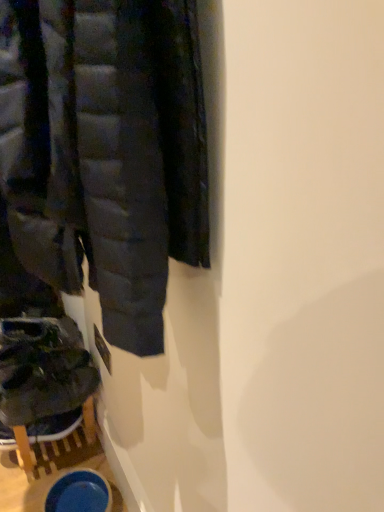
Question: Considering the relative positions of dark gray suede shoes at lower left and matte black jacket at left in the image provided, is dark gray suede shoes at lower left in front of matte black jacket at left?

Choices:
 (A) no
 (B) yes

Answer: (A)

Question: Does dark gray suede shoes at lower left appear on the left side of matte black jacket at left?

Choices:
 (A) yes
 (B) no

Answer: (A)

Question: Is dark gray suede shoes at lower left behind matte black jacket at left?

Choices:
 (A) yes
 (B) no

Answer: (A)

Question: Is dark gray suede shoes at lower left turned away from matte black jacket at left?

Choices:
 (A) no
 (B) yes

Answer: (A)

Question: Can you confirm if dark gray suede shoes at lower left is positioned to the right of matte black jacket at left?

Choices:
 (A) yes
 (B) no

Answer: (B)

Question: Does dark gray suede shoes at lower left have a lesser height compared to matte black jacket at left?

Choices:
 (A) yes
 (B) no

Answer: (A)

Question: Can we say matte black jacket at left lies outside dark gray suede shoes at lower left?

Choices:
 (A) no
 (B) yes

Answer: (B)

Question: Is matte black jacket at left not close to dark gray suede shoes at lower left?

Choices:
 (A) no
 (B) yes

Answer: (A)

Question: Does matte black jacket at left have a smaller size compared to dark gray suede shoes at lower left?

Choices:
 (A) yes
 (B) no

Answer: (B)

Question: From the image's perspective, is matte black jacket at left over dark gray suede shoes at lower left?

Choices:
 (A) yes
 (B) no

Answer: (A)

Question: Can you confirm if matte black jacket at left is thinner than dark gray suede shoes at lower left?

Choices:
 (A) yes
 (B) no

Answer: (A)

Question: Is matte black jacket at left at the left side of dark gray suede shoes at lower left?

Choices:
 (A) yes
 (B) no

Answer: (B)

Question: Is matte black jacket at left wider or thinner than dark gray suede shoes at lower left?

Choices:
 (A) wide
 (B) thin

Answer: (B)